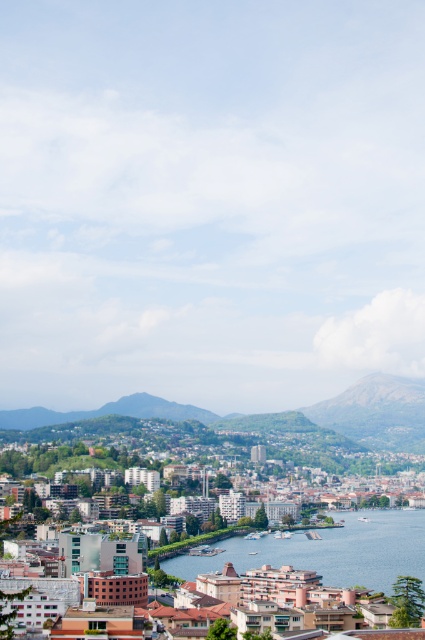
Question: Does matte brown buildings at center have a larger size compared to clear blue water at center?

Choices:
 (A) no
 (B) yes

Answer: (B)

Question: Does matte brown buildings at center appear over clear blue water at center?

Choices:
 (A) no
 (B) yes

Answer: (B)

Question: Which object is closer to the camera taking this photo?

Choices:
 (A) clear blue water at center
 (B) matte brown buildings at center

Answer: (B)

Question: Is matte brown buildings at center closer to camera compared to clear blue water at center?

Choices:
 (A) yes
 (B) no

Answer: (A)